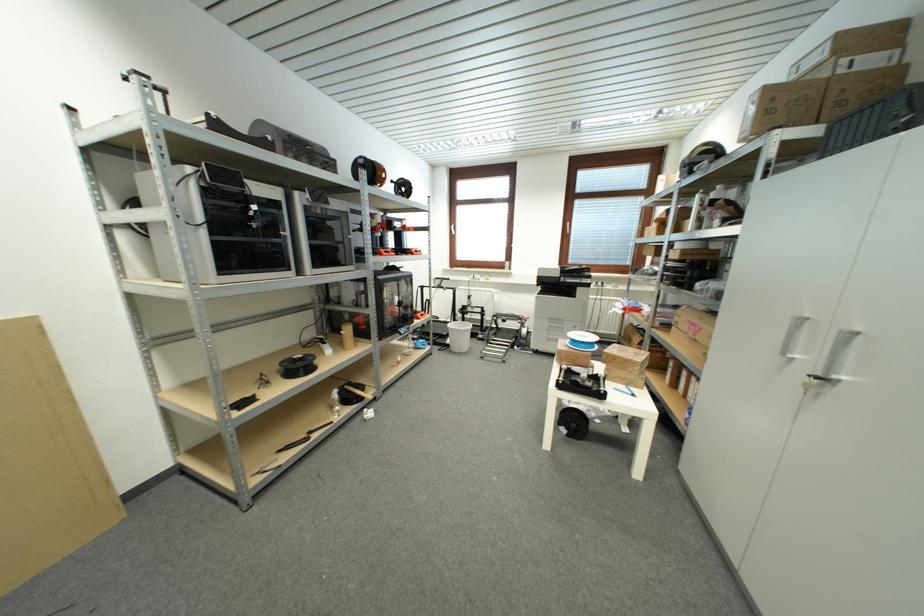
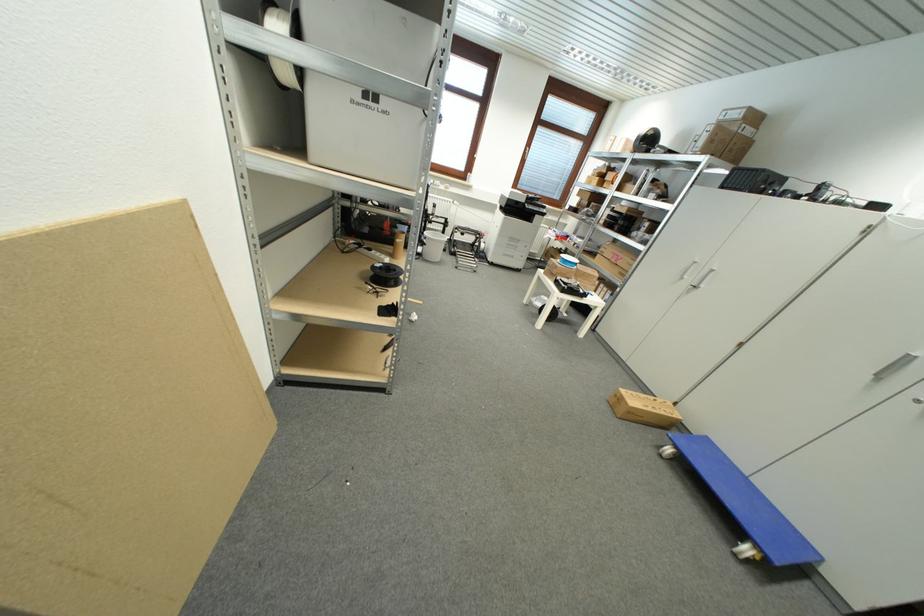
The point at (x=823, y=59) is marked in the first image. Where is the corresponding point in the second image?

(742, 116)